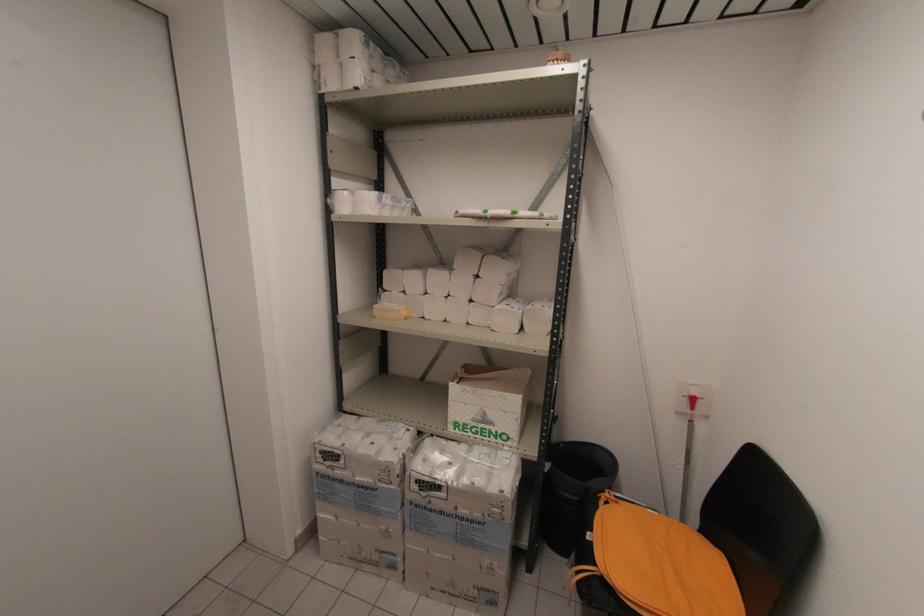
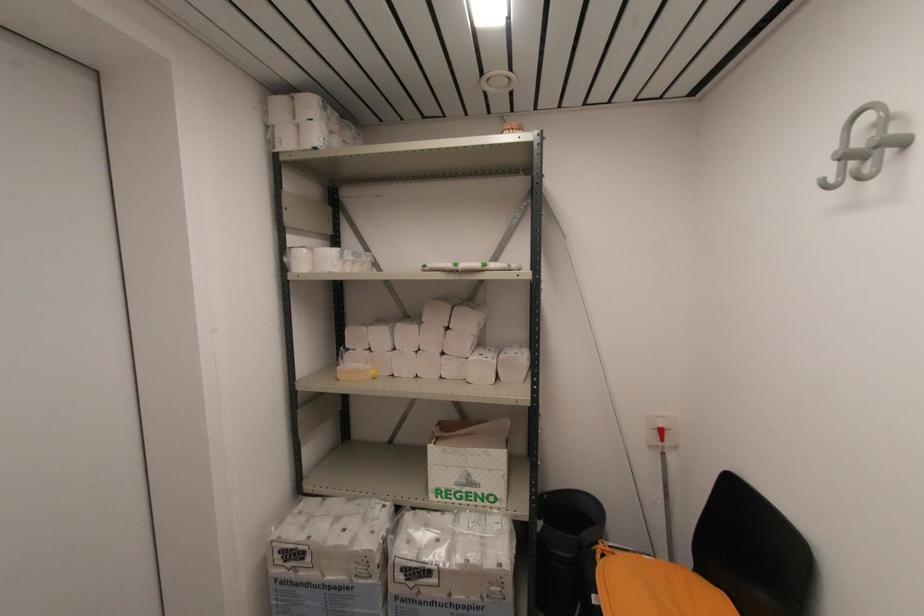
What movement of the cameraman would produce the second image?

The movement direction of the cameraman is left, forward.